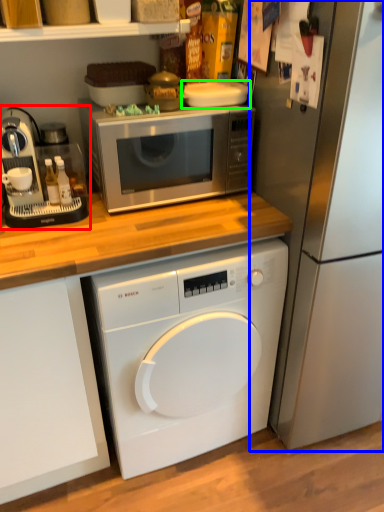
Question: Based on their relative distances, which object is farther from coffee machine (highlighted by a red box)? Choose from refrigerator (highlighted by a blue box) and appliance (highlighted by a green box).

Choices:
 (A) refrigerator
 (B) appliance

Answer: (A)